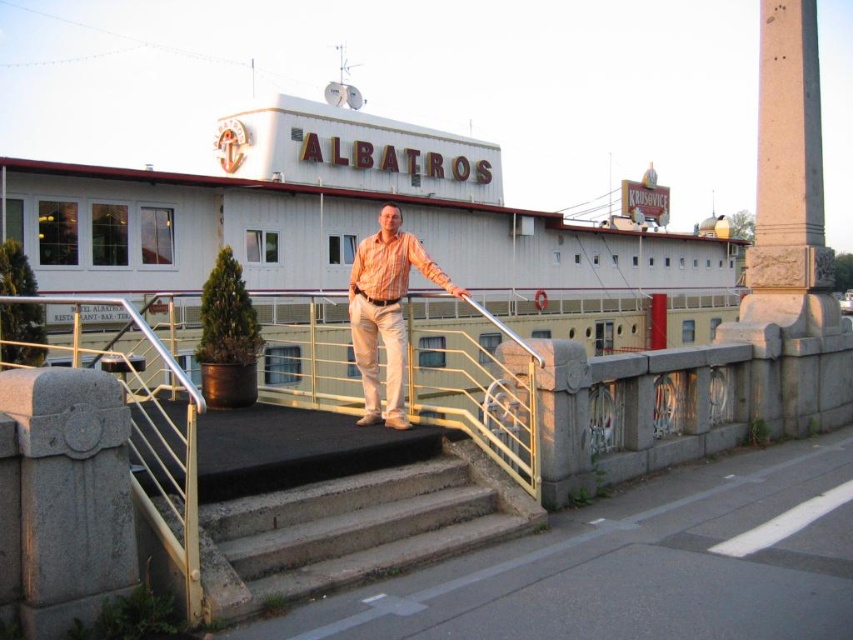
Question: Is concrete stairs at center wider than silver metallic railing at center?

Choices:
 (A) no
 (B) yes

Answer: (A)

Question: Which object is the closest to the matte orange shirt at center?

Choices:
 (A) silver metallic railing at center
 (B) concrete stairs at center

Answer: (B)

Question: Where is concrete stairs at center located in relation to silver metallic railing at center in the image?

Choices:
 (A) below
 (B) above

Answer: (A)

Question: Does concrete stairs at center appear on the right side of matte orange shirt at center?

Choices:
 (A) no
 (B) yes

Answer: (B)

Question: Estimate the real-world distances between objects in this image. Which object is closer to the matte orange shirt at center?

Choices:
 (A) silver metallic railing at center
 (B) concrete stairs at center

Answer: (B)

Question: Based on their relative distances, which object is farther from the silver metallic railing at center?

Choices:
 (A) matte orange shirt at center
 (B) concrete stairs at center

Answer: (A)